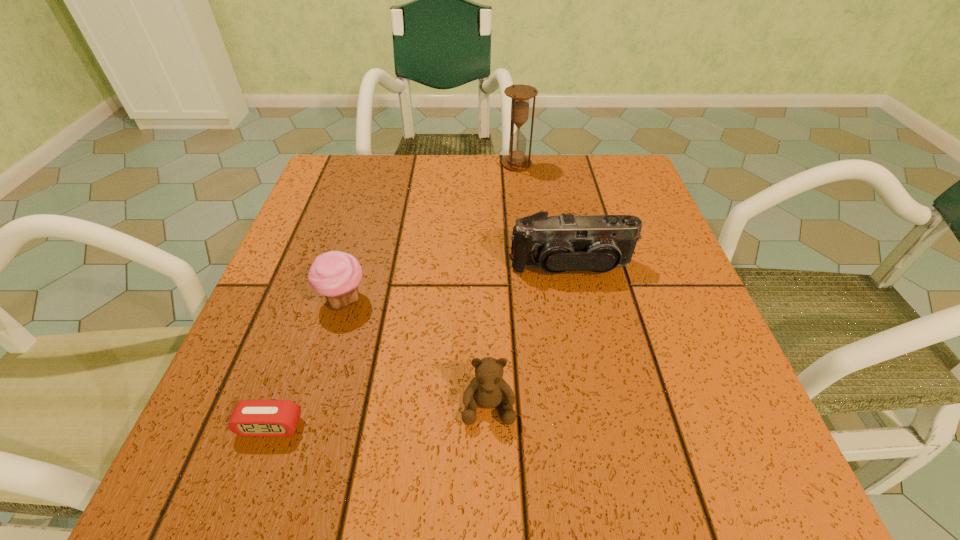
Identify which object is the third nearest to the third farthest object. Please provide its 2D coordinates. Your answer should be formatted as a tuple, i.e. [(x, y)], where the tuple contains the x and y coordinates of a point satisfying the conditions above.

[(597, 243)]

Where is `object that is the third closest to the third object from right to left`? The width and height of the screenshot is (960, 540). object that is the third closest to the third object from right to left is located at coordinates (255, 418).